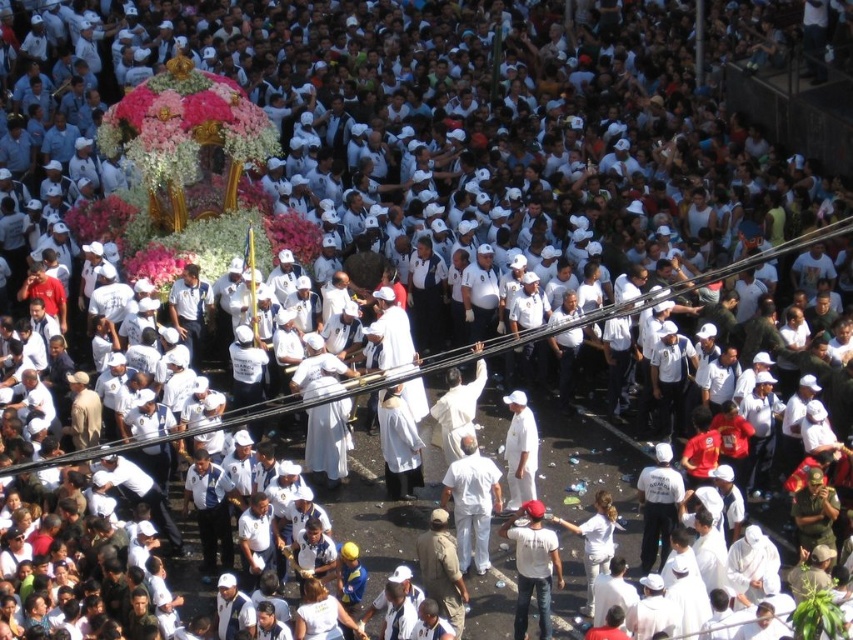
Question: Which point is farther to the camera?

Choices:
 (A) white matte clothing at center
 (B) white cotton shirt at lower right

Answer: (A)

Question: Is white matte clothing at center smaller than white cotton shirt at lower right?

Choices:
 (A) yes
 (B) no

Answer: (B)

Question: Does white matte clothing at center appear on the right side of white cotton shirt at lower right?

Choices:
 (A) no
 (B) yes

Answer: (A)

Question: Which point is closer to the camera?

Choices:
 (A) white matte clothing at center
 (B) white cotton shirt at lower right

Answer: (B)

Question: From the image, what is the correct spatial relationship of white matte clothing at center in relation to white cotton shirt at lower right?

Choices:
 (A) right
 (B) left

Answer: (B)

Question: Which point is farther from the camera taking this photo?

Choices:
 (A) (457, 492)
 (B) (553, 536)

Answer: (A)